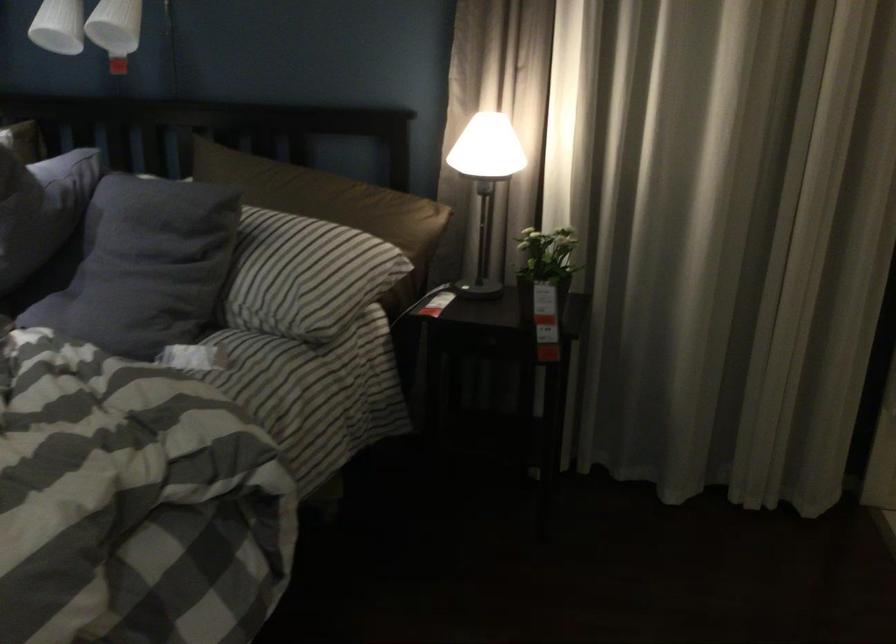
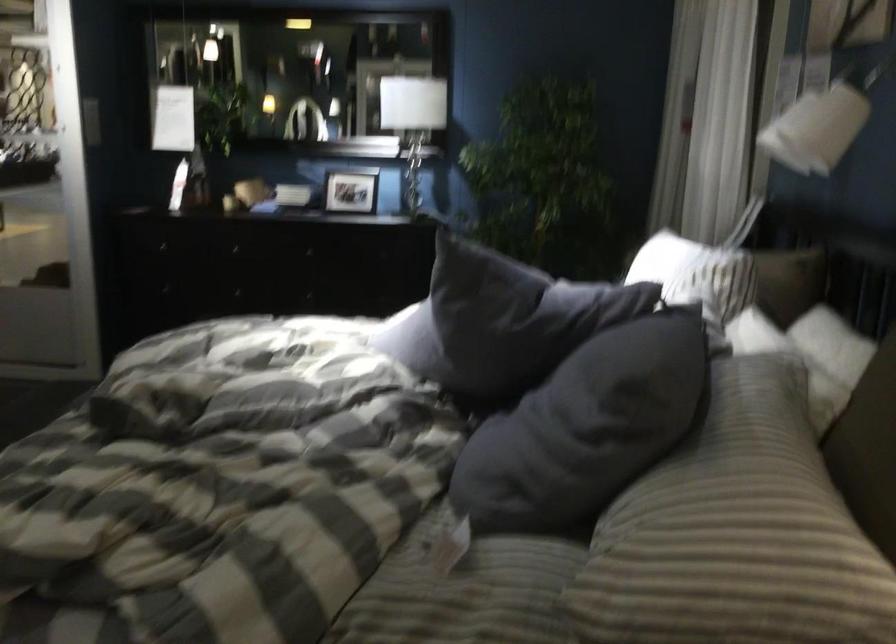
Find the pixel in the second image that matches (177,248) in the first image.

(596, 415)